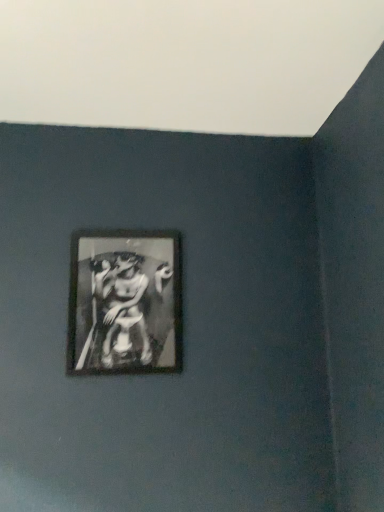
Image resolution: width=384 pixels, height=512 pixels. Find the location of `black glossy picture frame at center`. black glossy picture frame at center is located at coordinates (124, 304).

The width and height of the screenshot is (384, 512). Describe the element at coordinates (124, 304) in the screenshot. I see `black glossy picture frame at center` at that location.

Where is `black glossy picture frame at center`? black glossy picture frame at center is located at coordinates (124, 304).